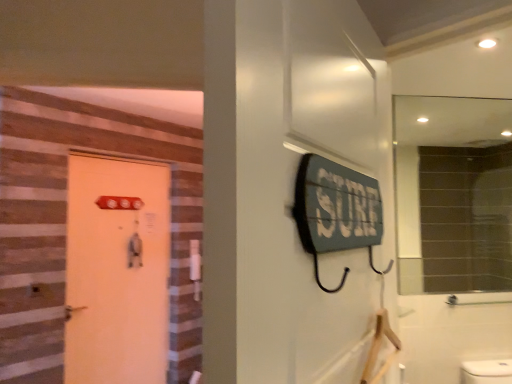
Question: Choose the correct answer: Is matte orange door at left inside matte glass mirror at upper right or outside it?

Choices:
 (A) outside
 (B) inside

Answer: (A)

Question: Considering the positions of matte orange door at left and matte glass mirror at upper right in the image, is matte orange door at left taller or shorter than matte glass mirror at upper right?

Choices:
 (A) tall
 (B) short

Answer: (A)

Question: Is point (153, 375) closer or farther from the camera than point (471, 170)?

Choices:
 (A) closer
 (B) farther

Answer: (A)

Question: Is matte glass mirror at upper right inside or outside of matte orange door at left?

Choices:
 (A) inside
 (B) outside

Answer: (B)

Question: Visually, is matte glass mirror at upper right positioned to the left or to the right of matte orange door at left?

Choices:
 (A) right
 (B) left

Answer: (A)

Question: Is point (493, 271) positioned closer to the camera than point (144, 281)?

Choices:
 (A) farther
 (B) closer

Answer: (A)

Question: From the image's perspective, is matte glass mirror at upper right located above or below matte orange door at left?

Choices:
 (A) above
 (B) below

Answer: (A)